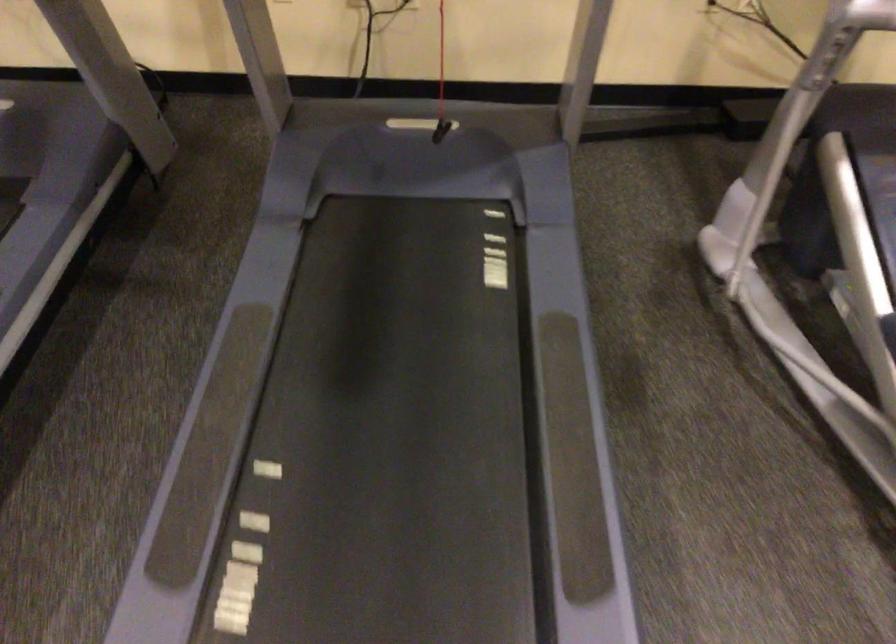
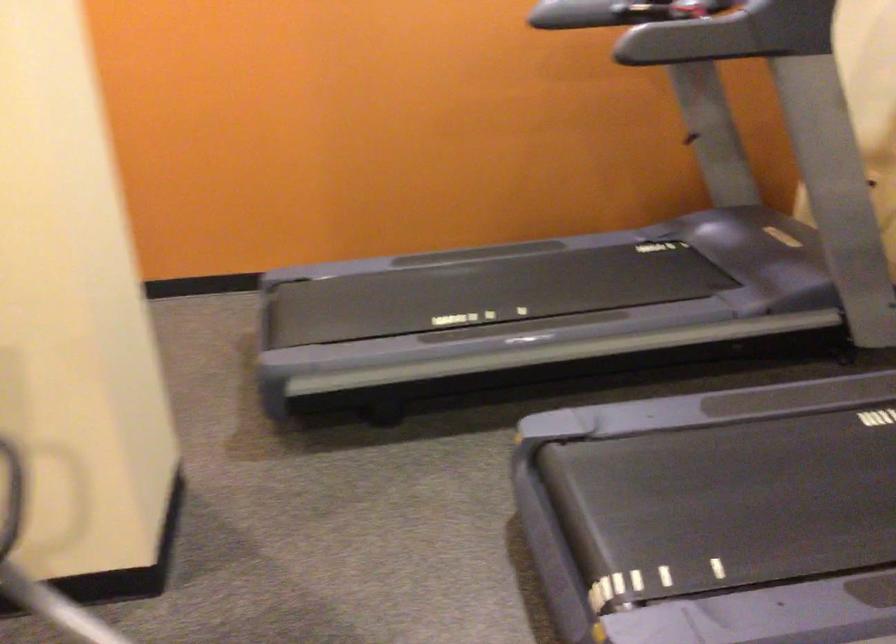
Based on the continuous images, in which direction is the camera rotating?

The camera's rotation is toward left-down.